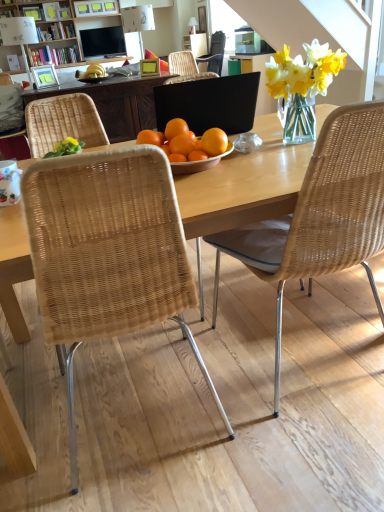
Question: Is wooden table at center next to woven rattan chair at left, the first chair when ordered from left to right, and touching it?

Choices:
 (A) no
 (B) yes

Answer: (A)

Question: Is the position of wooden table at center less distant than that of woven rattan chair at left, the first chair when ordered from left to right?

Choices:
 (A) yes
 (B) no

Answer: (A)

Question: Does wooden table at center have a larger size compared to woven rattan chair at left, the third chair viewed from the right?

Choices:
 (A) yes
 (B) no

Answer: (A)

Question: Is wooden table at center facing away from woven rattan chair at left, positioned as the third chair in front-to-back order?

Choices:
 (A) no
 (B) yes

Answer: (A)

Question: Is wooden table at center not near woven rattan chair at left, positioned as the third chair in front-to-back order?

Choices:
 (A) no
 (B) yes

Answer: (B)

Question: Does wooden table at center have a greater height compared to woven rattan chair at left, placed as the 1th chair when sorted from back to front?

Choices:
 (A) no
 (B) yes

Answer: (A)

Question: Is matte black television at upper center at the right side of matte green picture frame at upper center, the 2th picture frame positioned from the left?

Choices:
 (A) no
 (B) yes

Answer: (A)

Question: Is matte black television at upper center outside of matte green picture frame at upper center, positioned as the first picture frame in right-to-left order?

Choices:
 (A) yes
 (B) no

Answer: (A)

Question: Considering the relative sizes of matte black television at upper center and matte green picture frame at upper center, positioned as the first picture frame in right-to-left order, in the image provided, is matte black television at upper center smaller than matte green picture frame at upper center, positioned as the first picture frame in right-to-left order,?

Choices:
 (A) no
 (B) yes

Answer: (A)

Question: Considering the relative positions of matte black television at upper center and matte green picture frame at upper center, the 2th picture frame positioned from the left, in the image provided, is matte black television at upper center to the left of matte green picture frame at upper center, the 2th picture frame positioned from the left, from the viewer's perspective?

Choices:
 (A) no
 (B) yes

Answer: (B)

Question: Is the depth of matte black television at upper center less than that of matte green picture frame at upper center, the 2th picture frame positioned from the left?

Choices:
 (A) no
 (B) yes

Answer: (A)

Question: From a real-world perspective, is matte black television at upper center below matte green picture frame at upper center, positioned as the first picture frame in right-to-left order?

Choices:
 (A) yes
 (B) no

Answer: (B)

Question: Is black matte laptop at center with woven wicker chair at center, acting as the third chair starting from the back?

Choices:
 (A) no
 (B) yes

Answer: (A)